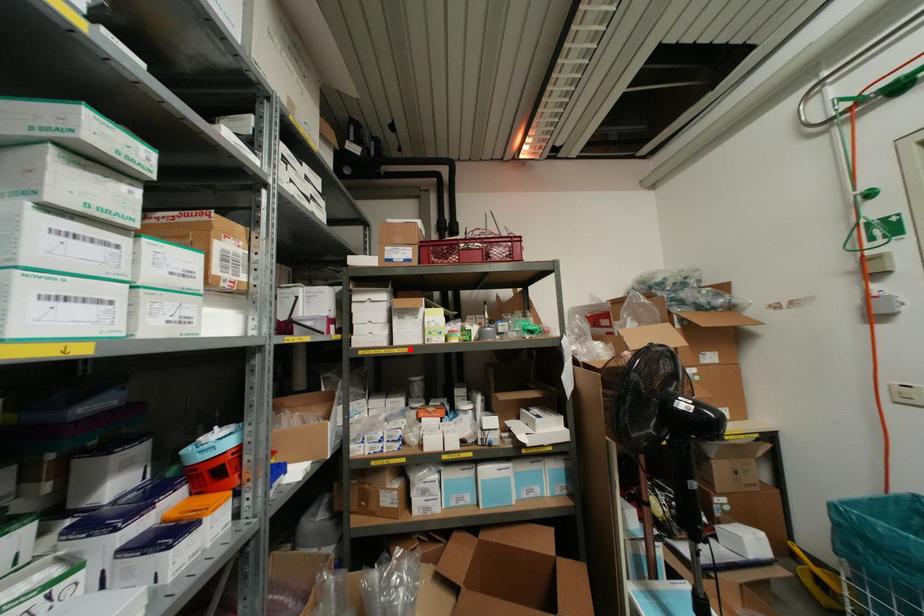
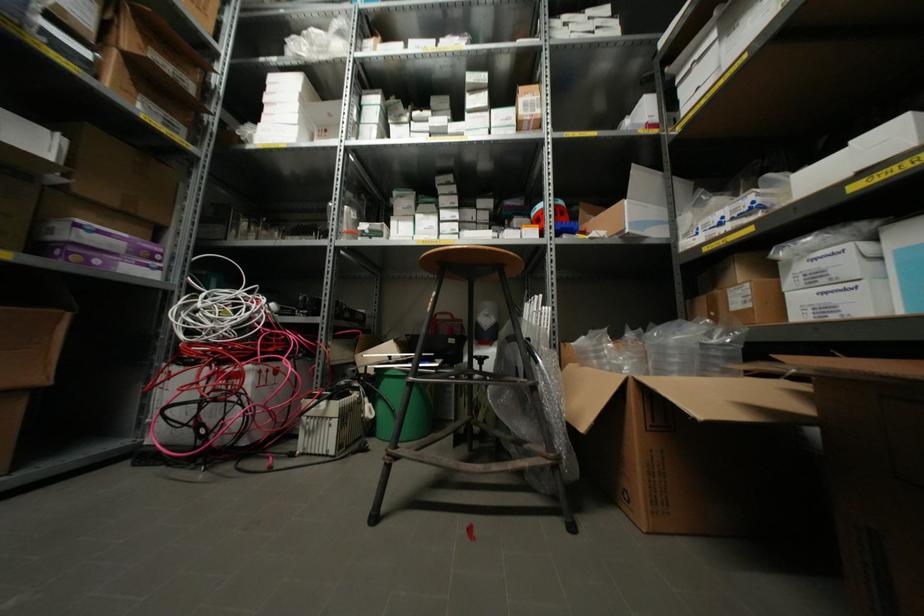
Locate, in the second image, the point that corresponds to the highlighted location in the first image.

(743, 55)